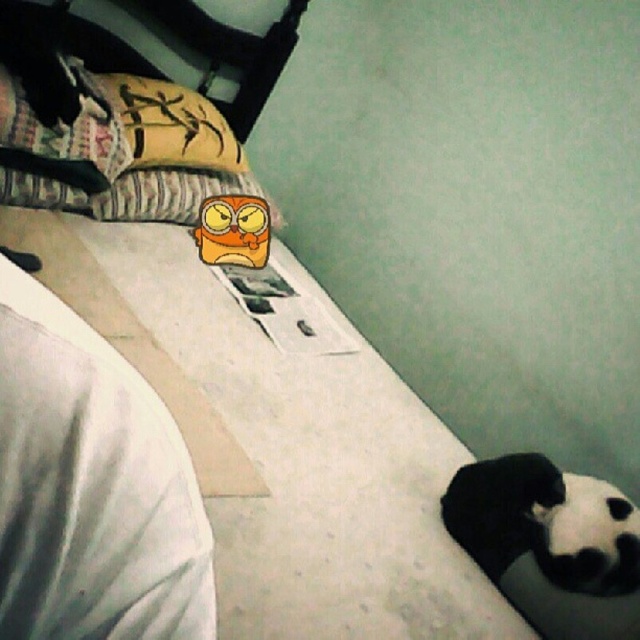
Question: Which of the following is the closest to the observer?

Choices:
 (A) black plush panda at lower right
 (B) orange plush toy at center

Answer: (A)

Question: Can you confirm if black plush panda at lower right is positioned below orange plush toy at center?

Choices:
 (A) no
 (B) yes

Answer: (B)

Question: Is black plush panda at lower right thinner than orange plush toy at center?

Choices:
 (A) yes
 (B) no

Answer: (B)

Question: Which point appears farthest from the camera in this image?

Choices:
 (A) (257, 241)
 (B) (620, 502)

Answer: (A)

Question: Is black plush panda at lower right positioned in front of orange plush toy at center?

Choices:
 (A) yes
 (B) no

Answer: (A)